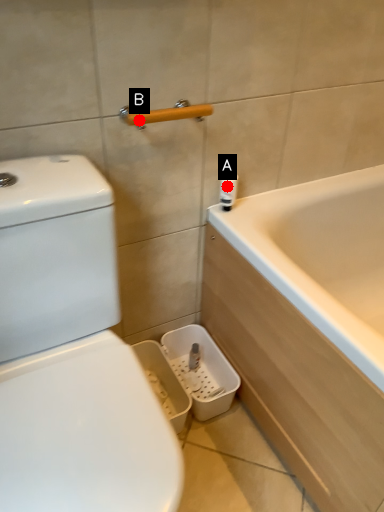
Question: Two points are circled on the image, labeled by A and B beside each circle. Which point is farther to the camera?

Choices:
 (A) A is further
 (B) B is further

Answer: (A)